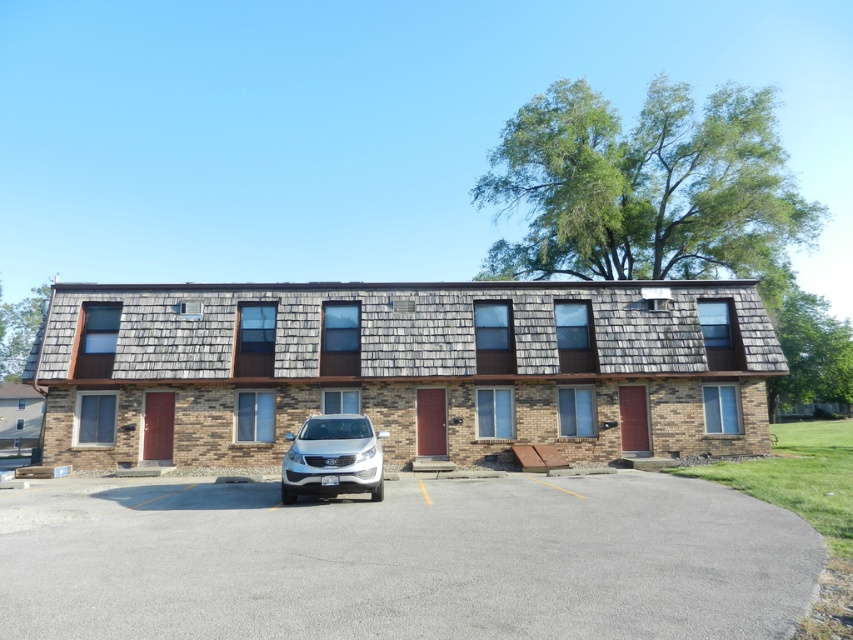
You are standing in front of the two story residential building and want to park your car in the gray asphalt parking lot at center. Is the white matte suv at center blocking your path to the parking lot?

The gray asphalt parking lot at center is closer to the viewer than the white matte suv at center, so the white matte suv at center is behind the parking lot and not blocking the path.

Looking at this image, you are a delivery driver who needs to park your white matte suv at center in the gray asphalt parking lot at center. Can you safely maneuver into the parking space?

The gray asphalt parking lot at center is to the right of the white matte suv at center, so the driver can safely maneuver into the parking space by moving to the right.

You are a delivery person arriving at the residential building. You need to park your white matte suv at center in a spot that is on the gray asphalt parking lot at center. Is the parking lot at center positioned in a way that allows you to park your SUV there?

The gray asphalt parking lot at center is located below the white matte suv at center, which means the SUV can be parked on the parking lot since the parking lot is positioned underneath it.